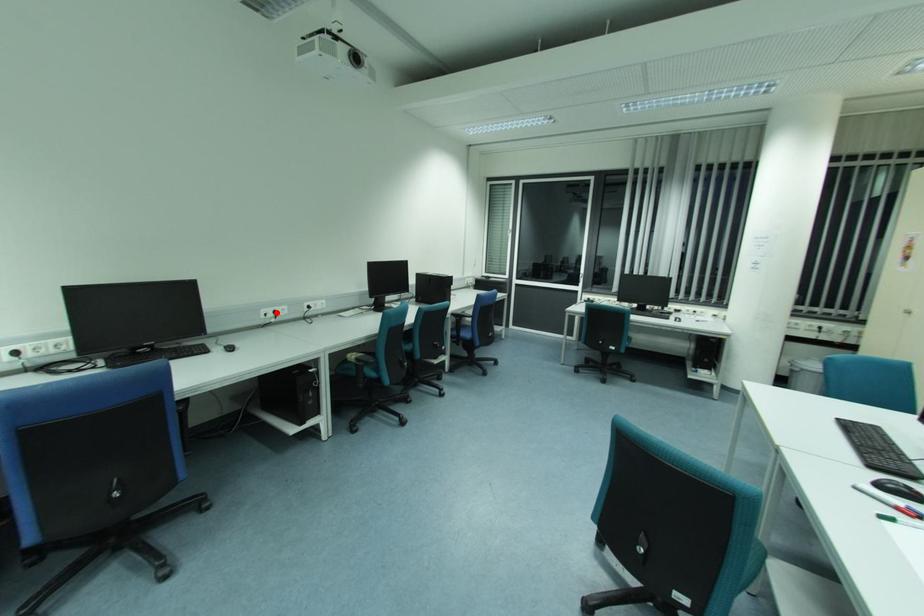
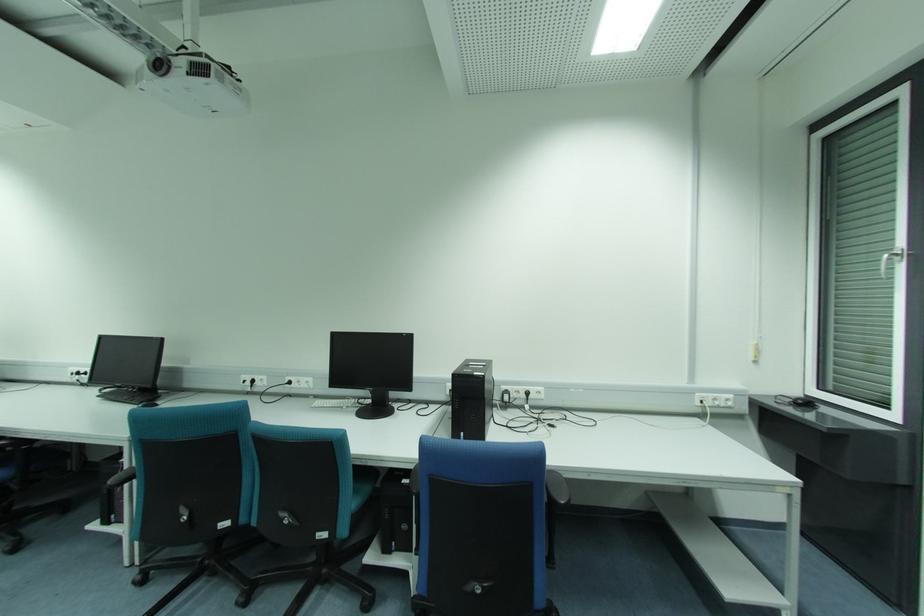
Question: I am providing you with two images of the same scene from different viewpoints. A red point is marked on the first image. At the location where the point appears in image 1, is it still visible in image 2?

Choices:
 (A) Yes
 (B) No

Answer: (A)